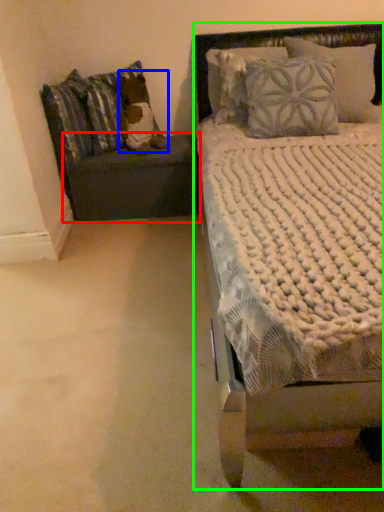
Question: Considering the real-world distances, which object is farthest from table (highlighted by a red box)? pillow (highlighted by a blue box) or bed (highlighted by a green box)?

Choices:
 (A) pillow
 (B) bed

Answer: (B)